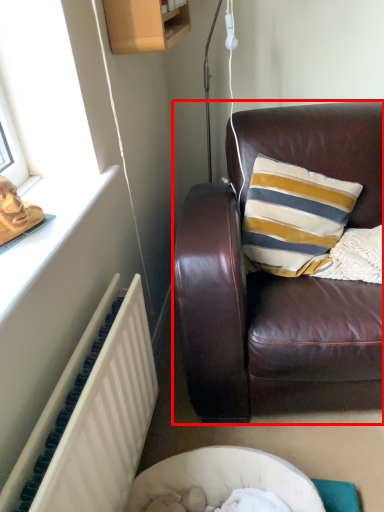
Question: In this image, where is studio couch (annotated by the red box) located relative to radiator?

Choices:
 (A) right
 (B) left

Answer: (A)